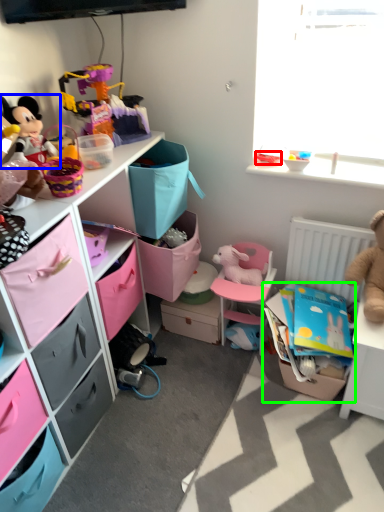
Question: Which object is the closest to the toy (highlighted by a red box)? Choose among these: toy (highlighted by a blue box) or storage box (highlighted by a green box).

Choices:
 (A) toy
 (B) storage box

Answer: (B)